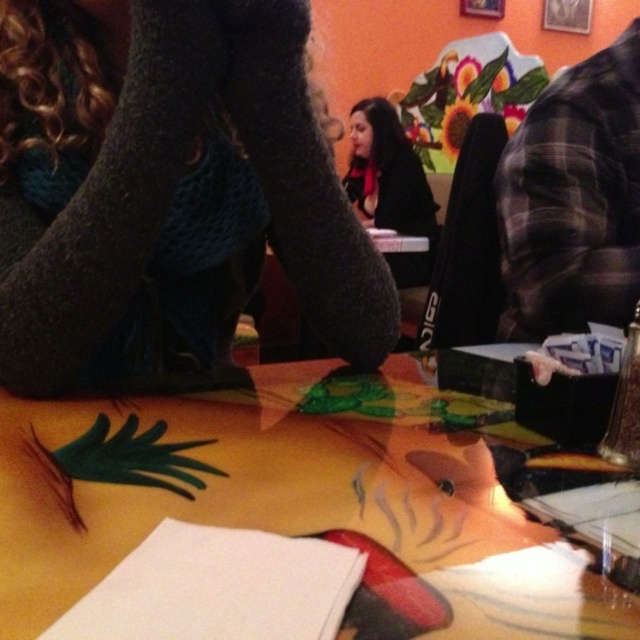
Question: Which point appears farthest from the camera in this image?

Choices:
 (A) (352, 116)
 (B) (154, 38)

Answer: (A)

Question: Considering the relative positions of wooden table at center and matte black jacket at center in the image provided, where is wooden table at center located with respect to matte black jacket at center?

Choices:
 (A) left
 (B) right

Answer: (A)

Question: Which object appears farthest from the camera in this image?

Choices:
 (A) wooden table at center
 (B) matte black jacket at center

Answer: (B)

Question: Which object is closer to the camera taking this photo?

Choices:
 (A) matte black jacket at center
 (B) wooden table at center
 (C) knitted dark gray socks at lower left

Answer: (B)

Question: Can you confirm if knitted dark gray socks at lower left is positioned above matte black jacket at center?

Choices:
 (A) no
 (B) yes

Answer: (A)

Question: Is knitted dark gray socks at lower left to the right of wooden table at center from the viewer's perspective?

Choices:
 (A) yes
 (B) no

Answer: (B)